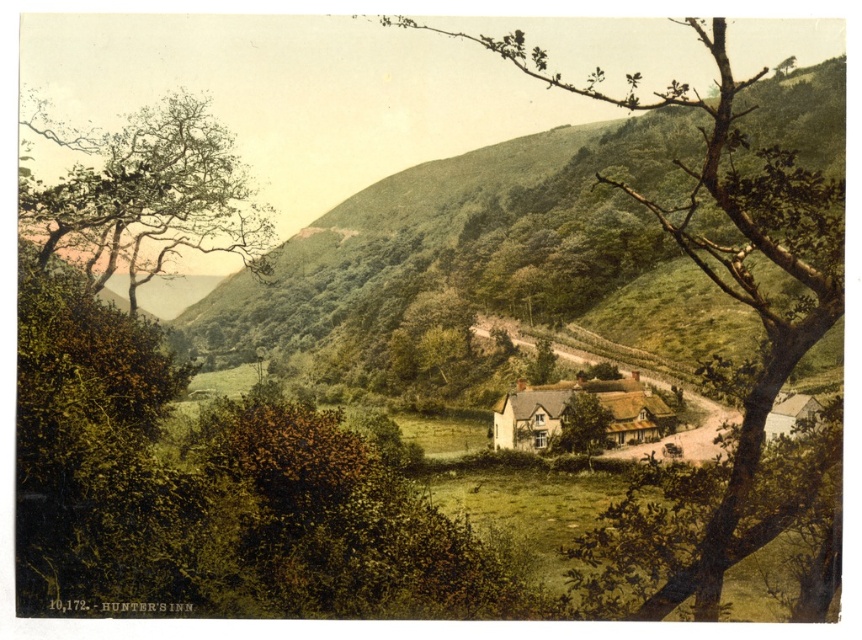
Does green leafy tree at center appear over green leafy tree at upper left?

Yes.

Is the position of green leafy tree at center more distant than that of green leafy tree at upper left?

No, it is in front of green leafy tree at upper left.

Between point (767, 241) and point (19, 196), which one is positioned in front?

Point (767, 241)

Where is `green leafy tree at center`? The height and width of the screenshot is (640, 862). green leafy tree at center is located at coordinates (729, 252).

Is green leafy hillside at center shorter than green leafy tree at center?

Yes, green leafy hillside at center is shorter than green leafy tree at center.

Who is more distant from viewer, (671, 112) or (792, 342)?

Positioned behind is point (671, 112).

Which is behind, point (561, 292) or point (564, 81)?

Point (564, 81)

Find the location of `green leafy hillside at center`. green leafy hillside at center is located at coordinates 431,228.

Which is more to the left, green leafy tree at center or thatched roof cottage at center?

From the viewer's perspective, thatched roof cottage at center appears more on the left side.

Which is behind, point (807, 339) or point (513, 432)?

The point (513, 432) is behind.

I want to click on green leafy tree at center, so pos(729,252).